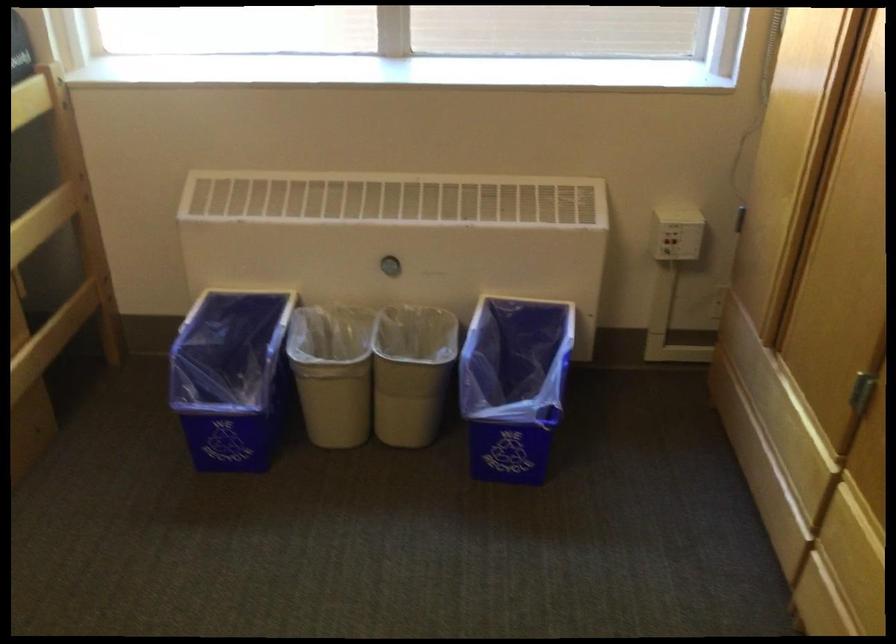
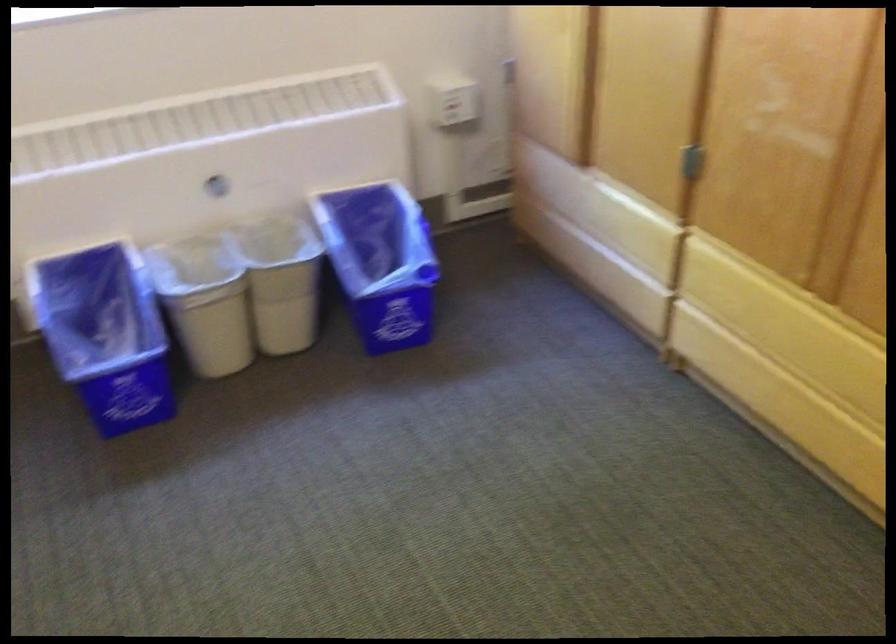
Locate, in the second image, the point that corresponds to point (403, 377) in the first image.

(281, 281)